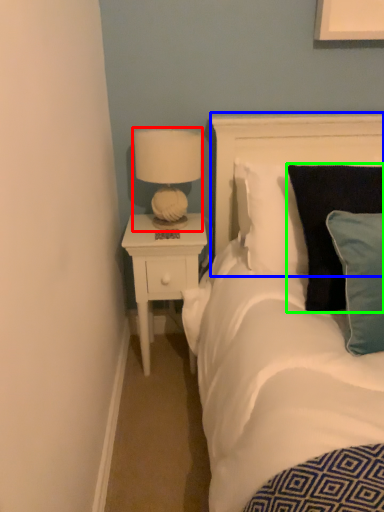
Question: Based on their relative distances, which object is nearer to lamp (highlighted by a red box)? Choose from headboard (highlighted by a blue box) and pillow (highlighted by a green box).

Choices:
 (A) headboard
 (B) pillow

Answer: (A)